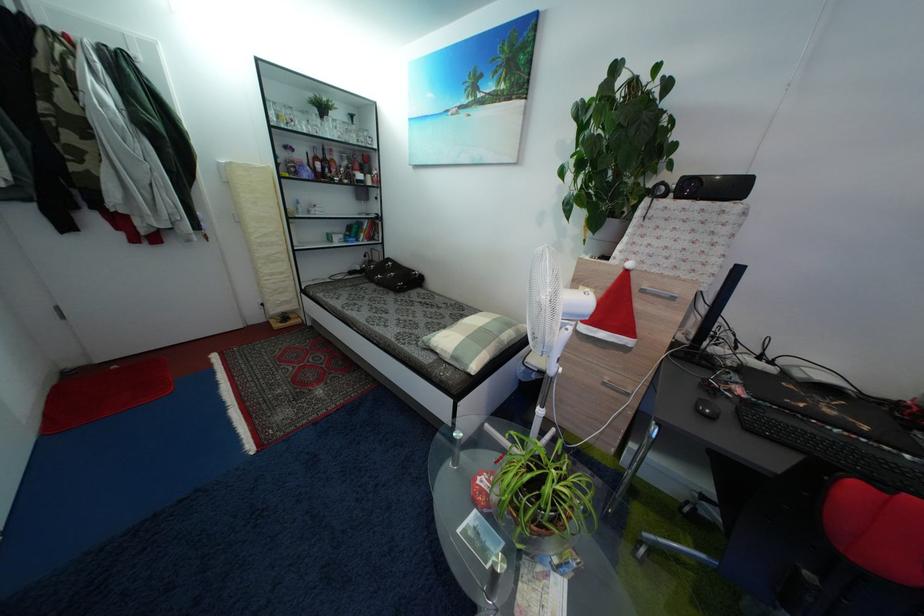
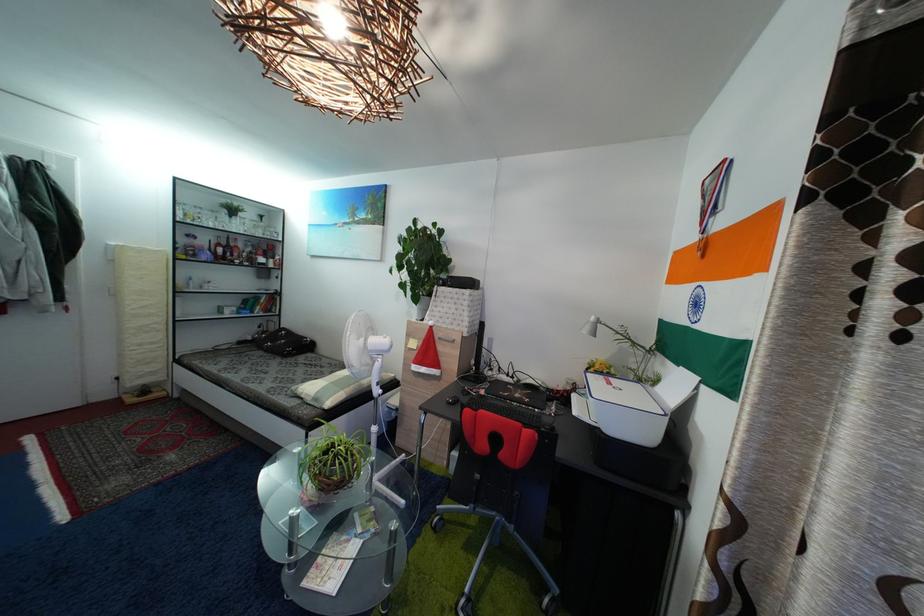
In the second image, find the point that corresponds to (x=310, y=159) in the first image.

(213, 246)